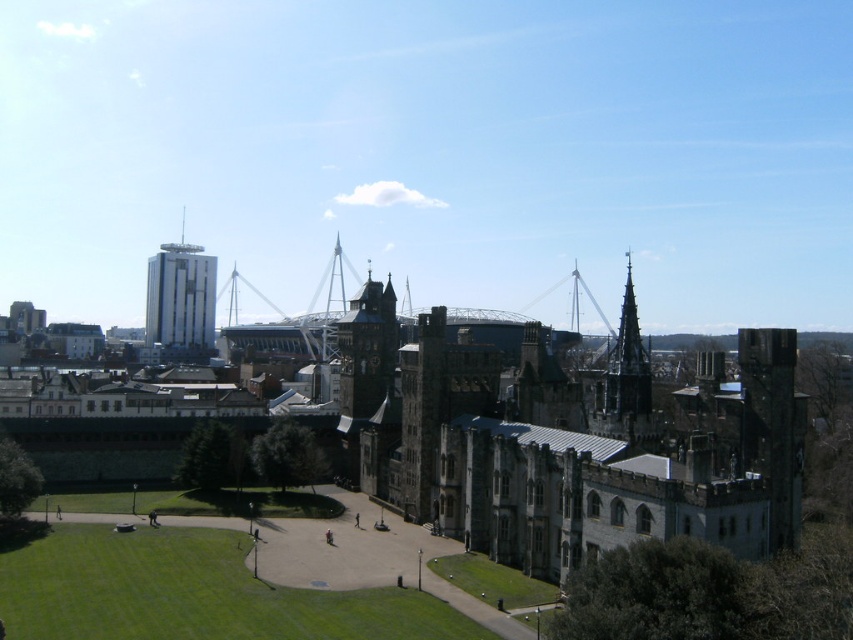
Question: Is the position of dark gray stone spire at upper right more distant than that of shiny silver spire at center?

Choices:
 (A) no
 (B) yes

Answer: (A)

Question: Is dark gray stone spire at upper right smaller than shiny silver spire at center?

Choices:
 (A) no
 (B) yes

Answer: (B)

Question: Which point is farther from the camera taking this photo?

Choices:
 (A) 160,291
 (B) 602,394
 (C) 788,528

Answer: (A)

Question: Which of the following is the farthest from the observer?

Choices:
 (A) (352, 273)
 (B) (636, 314)

Answer: (A)

Question: Which point is farther to the camera?

Choices:
 (A) (614, 412)
 (B) (314, 296)
 (C) (161, 248)
 (D) (405, 460)

Answer: (B)

Question: Observing the image, what is the correct spatial positioning of gray stone castle at center in reference to dark gray stone spire at upper right?

Choices:
 (A) left
 (B) right

Answer: (A)